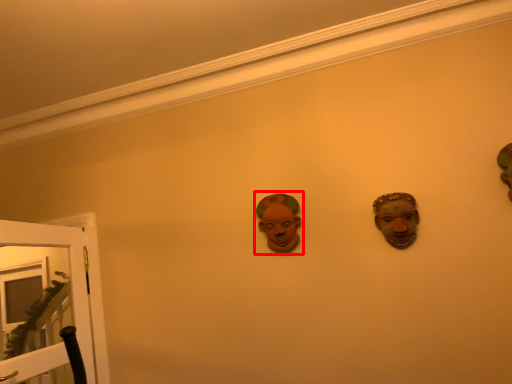
Question: Where is person (annotated by the red box) located in relation to door in the image?

Choices:
 (A) left
 (B) right

Answer: (B)